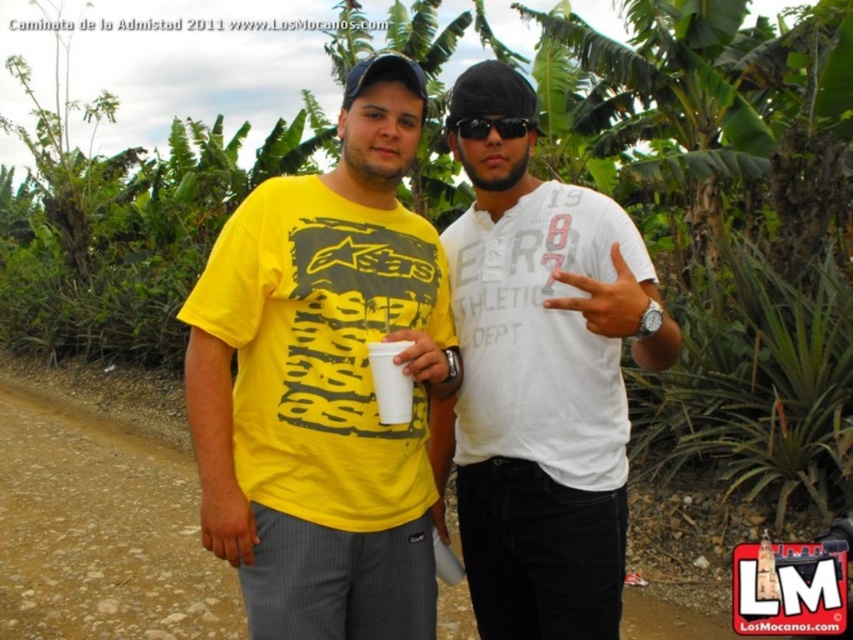
I want to click on white paper cup at center, so click(390, 381).

Who is more forward, (398, 403) or (532, 124)?

Point (398, 403)

Which is behind, point (392, 397) or point (523, 132)?

The point (523, 132) is more distant.

In order to click on white paper cup at center in this screenshot , I will do `click(390, 381)`.

Looking at this image, is white cotton shirt at center wider than black plastic sunglasses at center?

Yes.

Is white cotton shirt at center thinner than black plastic sunglasses at center?

No, white cotton shirt at center is not thinner than black plastic sunglasses at center.

Find the location of a particular element. white cotton shirt at center is located at coordinates (543, 394).

At what (x,y) coordinates should I click in order to perform the action: click on white cotton shirt at center. Please return your answer as a coordinate pair (x, y). The height and width of the screenshot is (640, 853). Looking at the image, I should click on (543, 394).

Locate an element on the screen. This screenshot has height=640, width=853. white cotton shirt at center is located at coordinates (543, 394).

Is white cotton shirt at center closer to the viewer compared to brown dirt track at lower left?

That is True.

What do you see at coordinates (543, 394) in the screenshot? I see `white cotton shirt at center` at bounding box center [543, 394].

This screenshot has width=853, height=640. In order to click on white cotton shirt at center in this screenshot , I will do `click(543, 394)`.